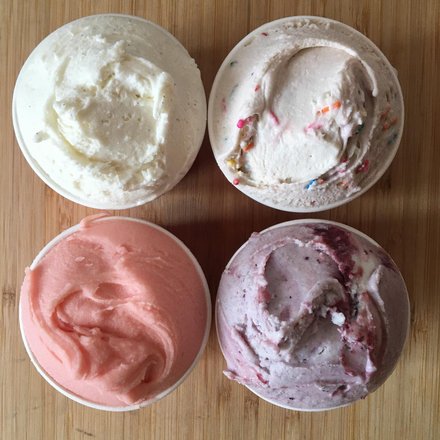
At what (x,y) coordinates should I click in order to perform the action: click on white bowls. Please return your answer as a coordinate pair (x, y). The width and height of the screenshot is (440, 440). Looking at the image, I should click on (107, 206), (270, 204), (193, 262), (232, 257).